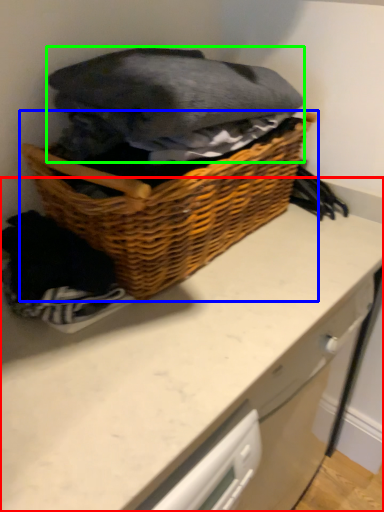
Question: Considering the real-world distances, which object is closest to counter (highlighted by a red box)? picnic basket (highlighted by a blue box) or clothing (highlighted by a green box).

Choices:
 (A) picnic basket
 (B) clothing

Answer: (A)